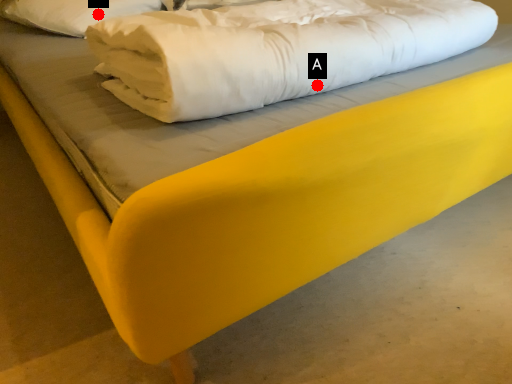
Question: Two points are circled on the image, labeled by A and B beside each circle. Which point is further to the camera?

Choices:
 (A) A is further
 (B) B is further

Answer: (B)